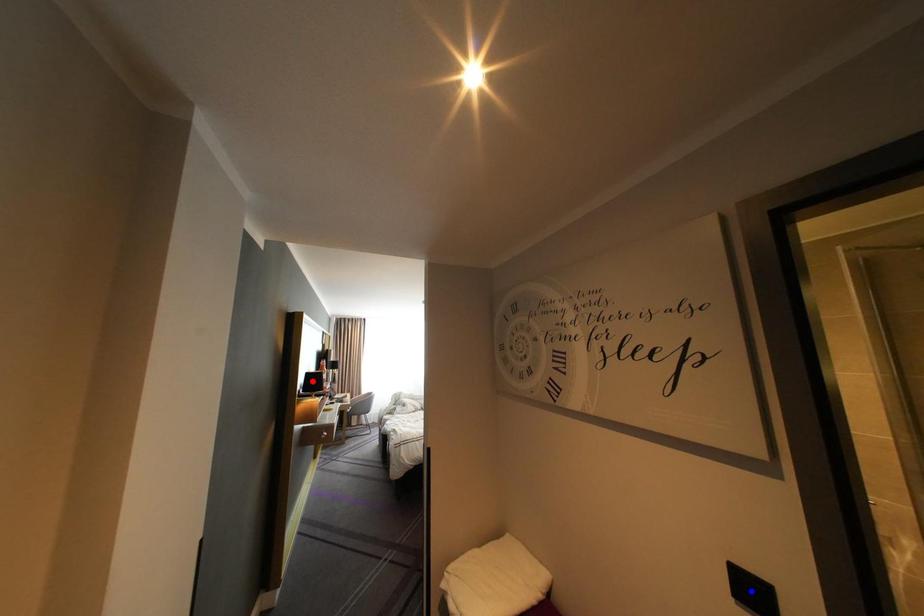
Question: Two points are marked on the image. Which point is closer to the camera?

Choices:
 (A) Blue point is closer.
 (B) Red point is closer.

Answer: (A)